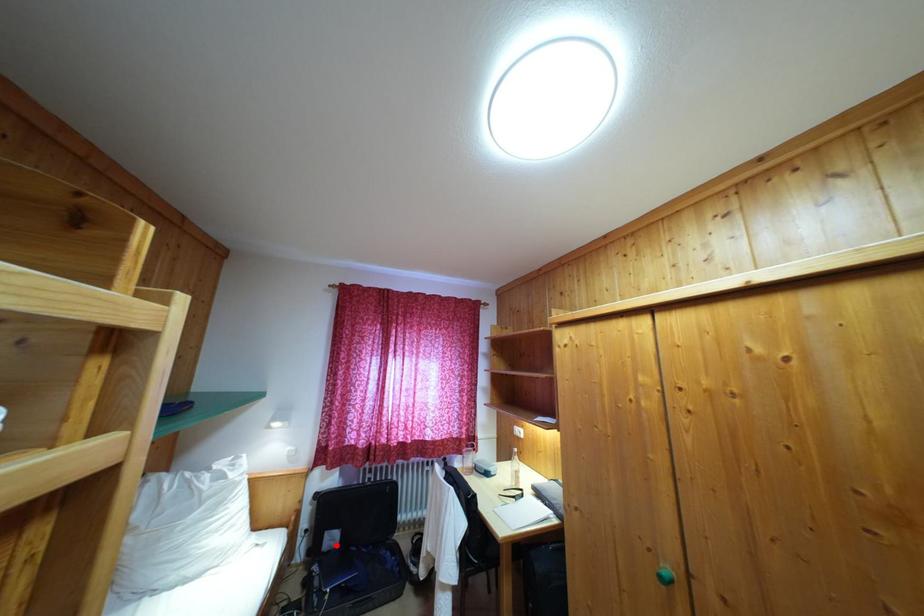
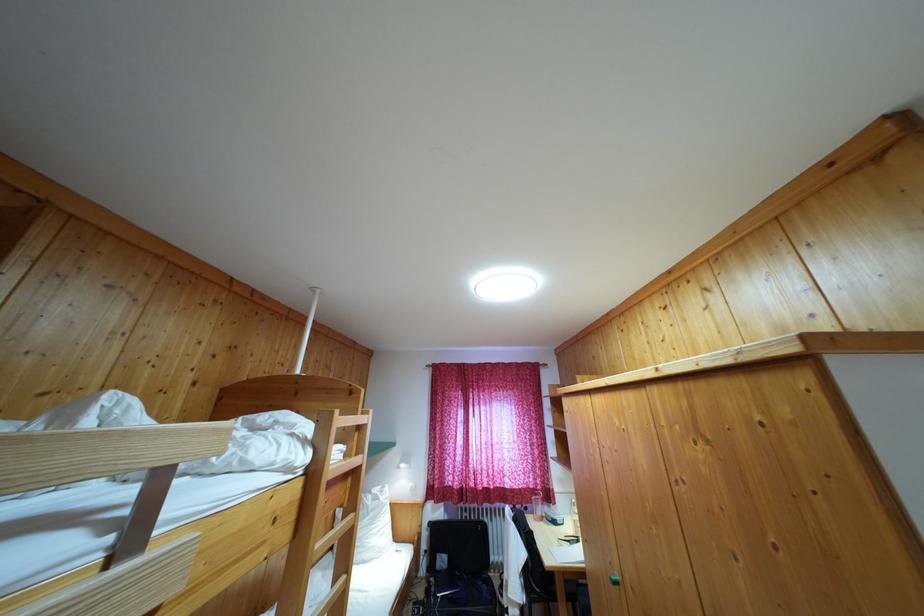
Question: A red point is marked in image1. In image2, is the corresponding 3D point closer to the camera or farther? Reply with the corresponding letter.

Choices:
 (A) The corresponding 3D point is closer.
 (B) The corresponding 3D point is farther.

Answer: (B)